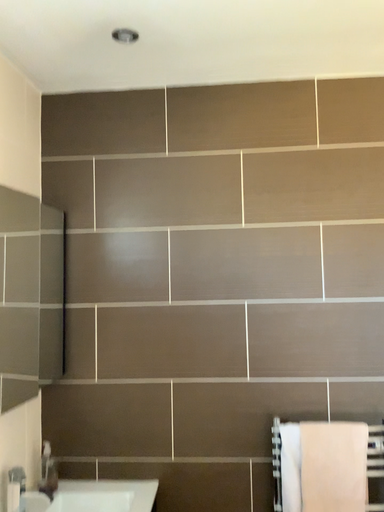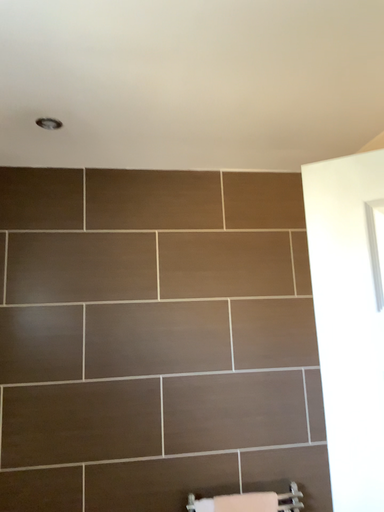
Question: Which way did the camera rotate in the video?

Choices:
 (A) rotated downward
 (B) rotated upward

Answer: (B)